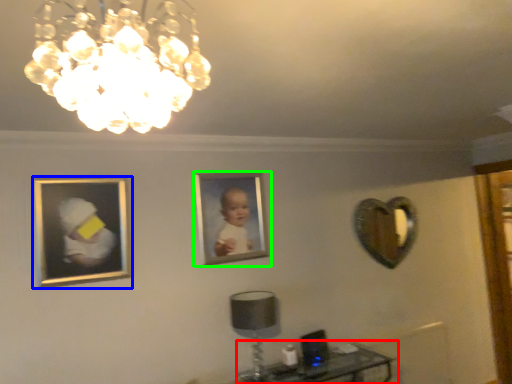
Question: Which object is positioned closest to table (highlighted by a red box)? Select from picture frame (highlighted by a blue box) and picture frame (highlighted by a green box).

Choices:
 (A) picture frame
 (B) picture frame

Answer: (B)